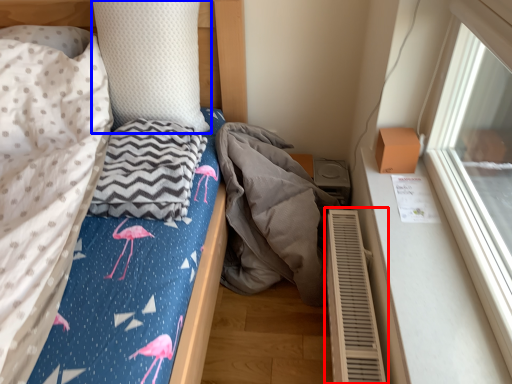
Question: Which object is further to the camera taking this photo, air conditioner (highlighted by a red box) or pillow (highlighted by a blue box)?

Choices:
 (A) air conditioner
 (B) pillow

Answer: (B)